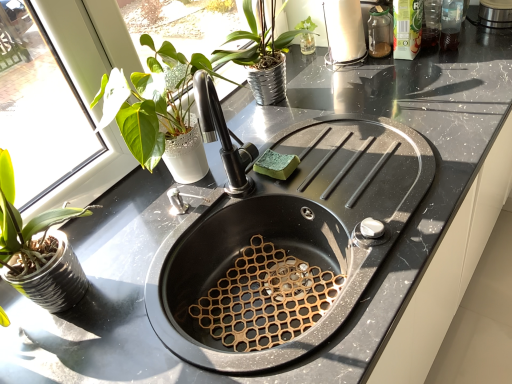
Locate an element on the screen. vacant space to the right of green sponge at sink is located at coordinates (338, 148).